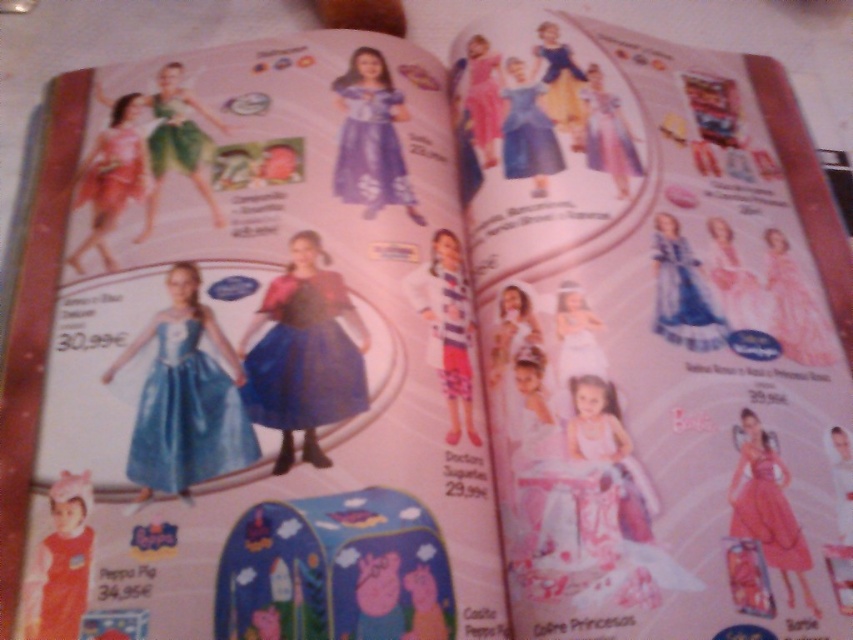
Based on the photo, does pink satin dress at lower right have a lesser height compared to pink satin dress at upper center?

Yes, pink satin dress at lower right is shorter than pink satin dress at upper center.

Which is in front, point (792, 570) or point (456, 61)?

Positioned in front is point (792, 570).

Identify the location of pink satin dress at lower right. (767, 508).

Can you confirm if purple satin dress at center is taller than blue satin dress at upper right?

Yes, purple satin dress at center is taller than blue satin dress at upper right.

Does purple satin dress at center lie behind blue satin dress at upper right?

Yes, it is behind blue satin dress at upper right.

What do you see at coordinates (370, 138) in the screenshot?
I see `purple satin dress at center` at bounding box center [370, 138].

Locate an element on the screen. purple satin dress at center is located at coordinates (370, 138).

Does pink satin dress at lower right appear over pink satin dress at upper left?

Incorrect, pink satin dress at lower right is not positioned above pink satin dress at upper left.

Does pink satin dress at lower right lie behind pink satin dress at upper left?

No, pink satin dress at lower right is in front of pink satin dress at upper left.

Find the location of a particular element. pink satin dress at lower right is located at coordinates (767, 508).